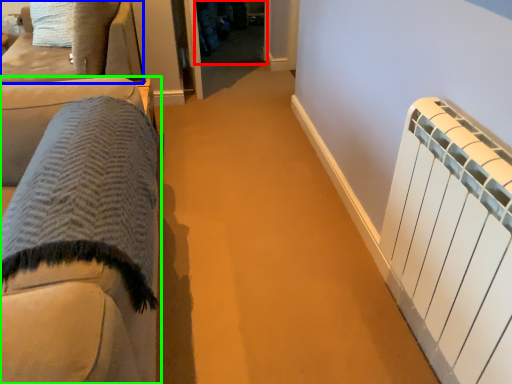
Question: Considering the real-world distances, which object is farthest from glass door (highlighted by a red box)? furniture (highlighted by a blue box) or furniture (highlighted by a green box)?

Choices:
 (A) furniture
 (B) furniture

Answer: (B)